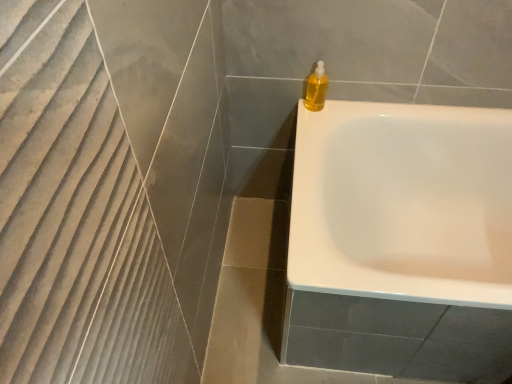
Question: Should I look upward or downward to see white glossy bathtub at upper right?

Choices:
 (A) up
 (B) down

Answer: (B)

Question: Considering the relative positions of white glossy bathtub at upper right and translucent yellow liquid at upper right in the image provided, is white glossy bathtub at upper right to the left of translucent yellow liquid at upper right from the viewer's perspective?

Choices:
 (A) yes
 (B) no

Answer: (B)

Question: From a real-world perspective, does white glossy bathtub at upper right stand above translucent yellow liquid at upper right?

Choices:
 (A) no
 (B) yes

Answer: (A)

Question: Is white glossy bathtub at upper right shorter than translucent yellow liquid at upper right?

Choices:
 (A) yes
 (B) no

Answer: (B)

Question: Is white glossy bathtub at upper right turned away from translucent yellow liquid at upper right?

Choices:
 (A) yes
 (B) no

Answer: (B)

Question: From the image's perspective, would you say white glossy bathtub at upper right is shown under translucent yellow liquid at upper right?

Choices:
 (A) yes
 (B) no

Answer: (A)

Question: Is white glossy bathtub at upper right to the right of translucent yellow liquid at upper right from the viewer's perspective?

Choices:
 (A) no
 (B) yes

Answer: (B)

Question: Is translucent yellow liquid at upper right shorter than white glossy bathtub at upper right?

Choices:
 (A) yes
 (B) no

Answer: (A)

Question: Does translucent yellow liquid at upper right lie in front of white glossy bathtub at upper right?

Choices:
 (A) no
 (B) yes

Answer: (A)

Question: Is white glossy bathtub at upper right inside translucent yellow liquid at upper right?

Choices:
 (A) no
 (B) yes

Answer: (A)

Question: Is there a large distance between translucent yellow liquid at upper right and white glossy bathtub at upper right?

Choices:
 (A) yes
 (B) no

Answer: (B)

Question: Can you confirm if translucent yellow liquid at upper right is wider than white glossy bathtub at upper right?

Choices:
 (A) yes
 (B) no

Answer: (B)

Question: From a real-world perspective, is translucent yellow liquid at upper right physically below white glossy bathtub at upper right?

Choices:
 (A) yes
 (B) no

Answer: (B)

Question: From a real-world perspective, is translucent yellow liquid at upper right above or below white glossy bathtub at upper right?

Choices:
 (A) above
 (B) below

Answer: (A)